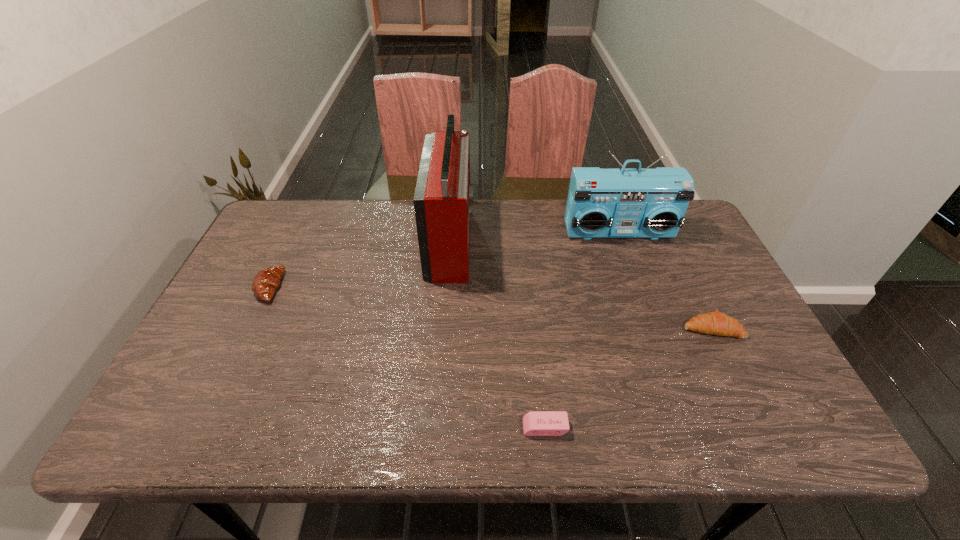
Locate an element on the screen. This screenshot has width=960, height=540. free space located on the front-facing side of the fourth object from right to left is located at coordinates (567, 241).

Locate an element on the screen. blank area located 0.140m on the front-facing side of the shorter radio receiver is located at coordinates (635, 275).

Image resolution: width=960 pixels, height=540 pixels. What are the coordinates of `vacant space located on the back of the farther crescent roll` in the screenshot? It's located at (310, 202).

Identify the location of vacant space located 0.310m on the left of the right crescent roll. (561, 328).

The image size is (960, 540). Find the location of `vacant point located 0.290m on the back of the eraser`. vacant point located 0.290m on the back of the eraser is located at coordinates (532, 315).

Image resolution: width=960 pixels, height=540 pixels. I want to click on object present at the near edge, so click(x=535, y=423).

Where is `object situated at the left edge`? This screenshot has width=960, height=540. object situated at the left edge is located at coordinates (266, 281).

The width and height of the screenshot is (960, 540). I want to click on radio receiver at the right edge, so click(x=602, y=203).

Locate an element on the screen. This screenshot has width=960, height=540. crescent roll that is at the right edge is located at coordinates (716, 323).

The height and width of the screenshot is (540, 960). Find the location of `object that is at the far right corner`. object that is at the far right corner is located at coordinates (602, 203).